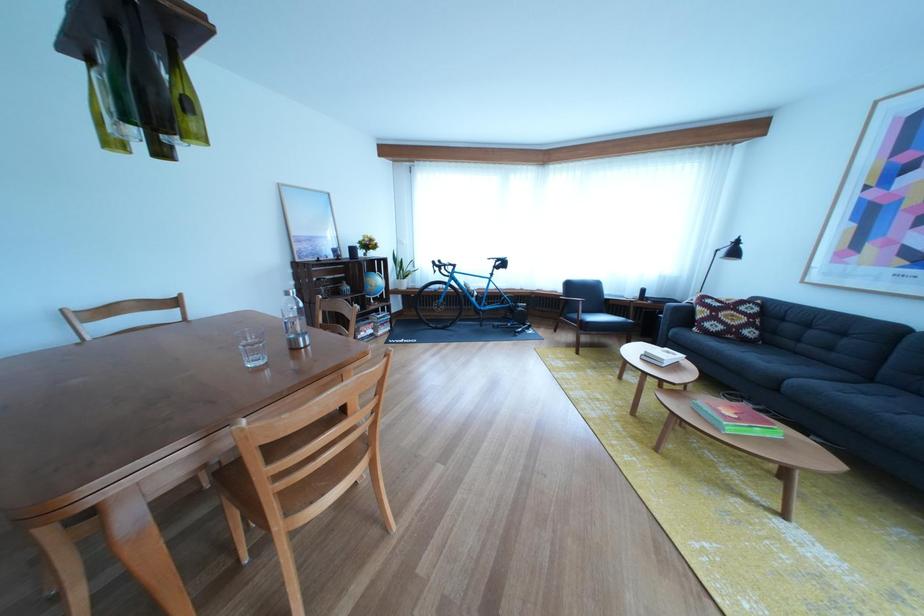
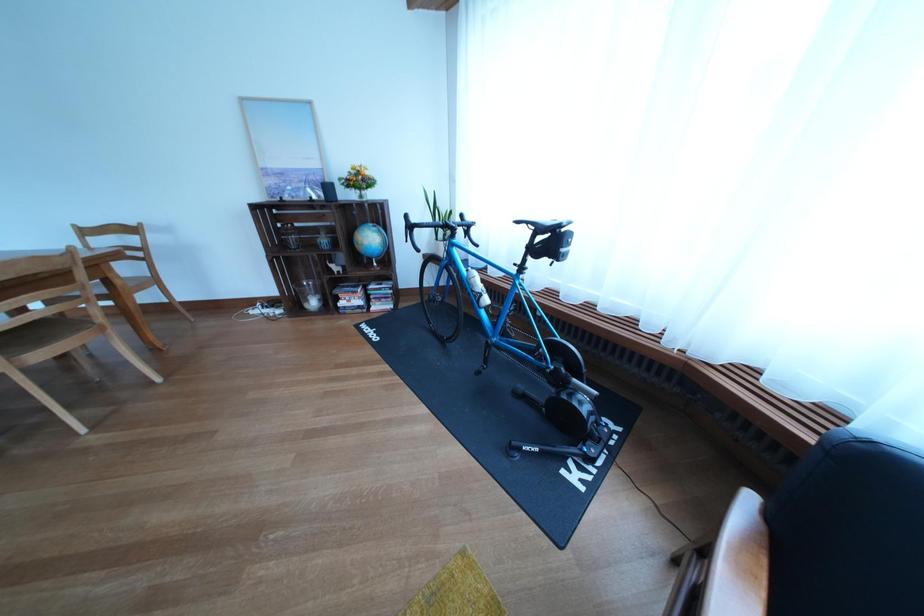
Find the pixel in the second image that matches [322,246] in the first image.

(294, 179)